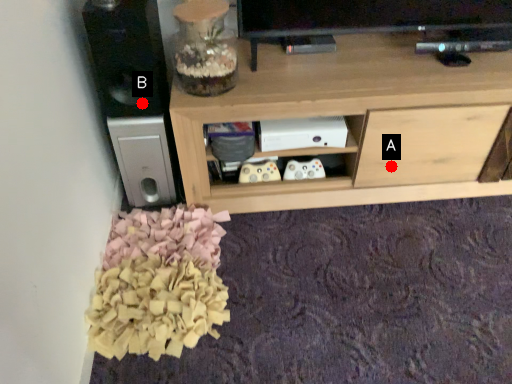
Question: Two points are circled on the image, labeled by A and B beside each circle. Which point is further to the camera?

Choices:
 (A) A is further
 (B) B is further

Answer: (A)